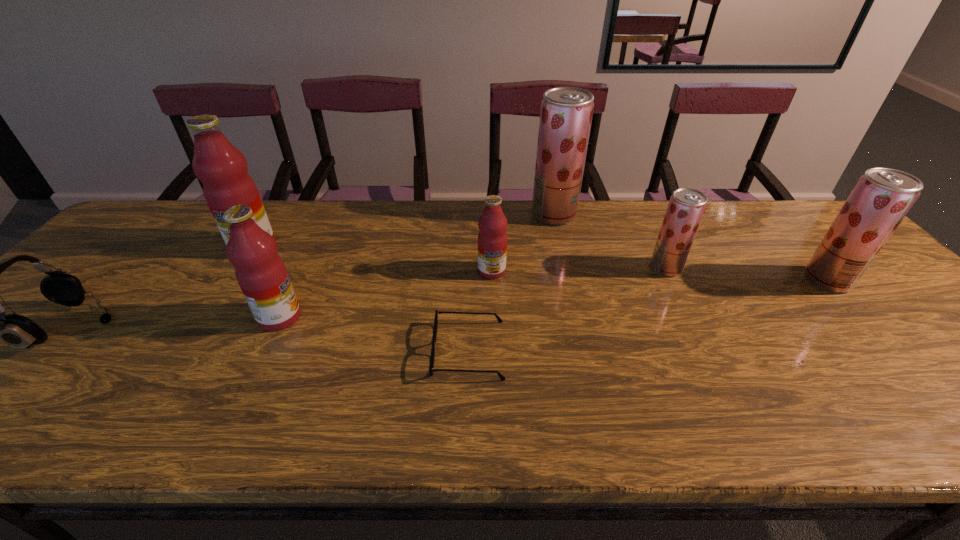
Locate an element on the screen. This screenshot has height=540, width=960. the seventh closest object relative to the seventh tallest object is located at coordinates (882, 197).

Select which object appears as the second closest to the leftmost fruit juice. Please provide its 2D coordinates. Your answer should be formatted as a tuple, i.e. [(x, y)], where the tuple contains the x and y coordinates of a point satisfying the conditions above.

[(19, 332)]

Select which fruit juice appears as the third closest to the rightmost strawberry fruit juice. Please provide its 2D coordinates. Your answer should be formatted as a tuple, i.e. [(x, y)], where the tuple contains the x and y coordinates of a point satisfying the conditions above.

[(492, 238)]

At what (x,y) coordinates should I click in order to perform the action: click on fruit juice that stands as the closest to the leftmost fruit juice. Please return your answer as a coordinate pair (x, y). Looking at the image, I should click on (261, 273).

Find the location of `the second closest strawberry fruit juice to the third object from left to right`. the second closest strawberry fruit juice to the third object from left to right is located at coordinates (686, 207).

Identify which strawberry fruit juice is the second closest to the second strawberry fruit juice from left to right. Please provide its 2D coordinates. Your answer should be formatted as a tuple, i.e. [(x, y)], where the tuple contains the x and y coordinates of a point satisfying the conditions above.

[(882, 197)]

The width and height of the screenshot is (960, 540). Identify the location of the second closest pink fruit juice to the nearest pink fruit juice. (492, 238).

Choose which pink fruit juice is the second nearest neighbor to the second strawberry fruit juice from left to right. Please provide its 2D coordinates. Your answer should be formatted as a tuple, i.e. [(x, y)], where the tuple contains the x and y coordinates of a point satisfying the conditions above.

[(261, 273)]

Locate an element on the screen. The height and width of the screenshot is (540, 960). vacant space that satisfies the following two spatial constraints: 1. on the front-facing side of the rightmost fruit juice; 2. on the left side of the spectacles is located at coordinates (470, 280).

Where is `free location that satisfies the following two spatial constraints: 1. on the front-facing side of the spectacles; 2. on the left side of the smallest strawberry fruit juice`? free location that satisfies the following two spatial constraints: 1. on the front-facing side of the spectacles; 2. on the left side of the smallest strawberry fruit juice is located at coordinates pyautogui.click(x=470, y=268).